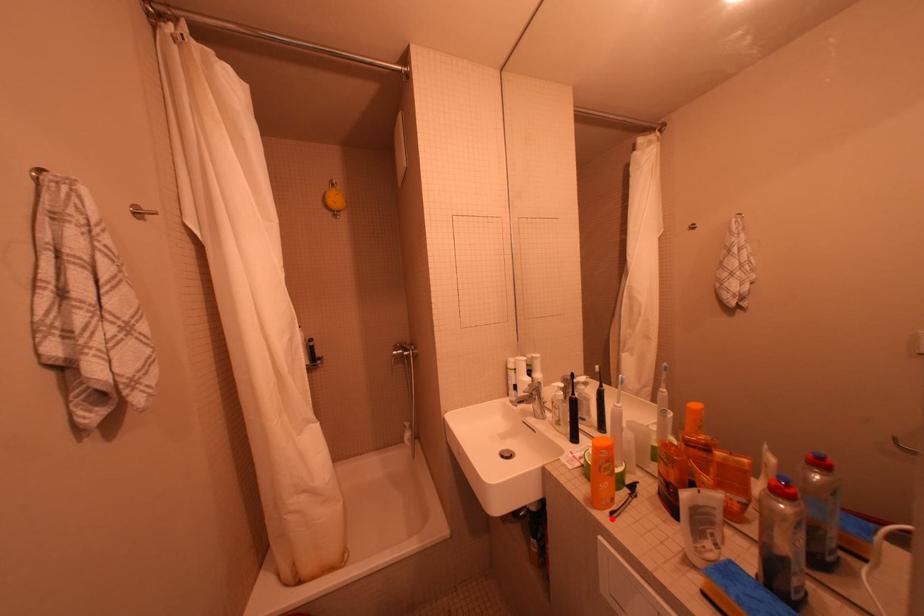
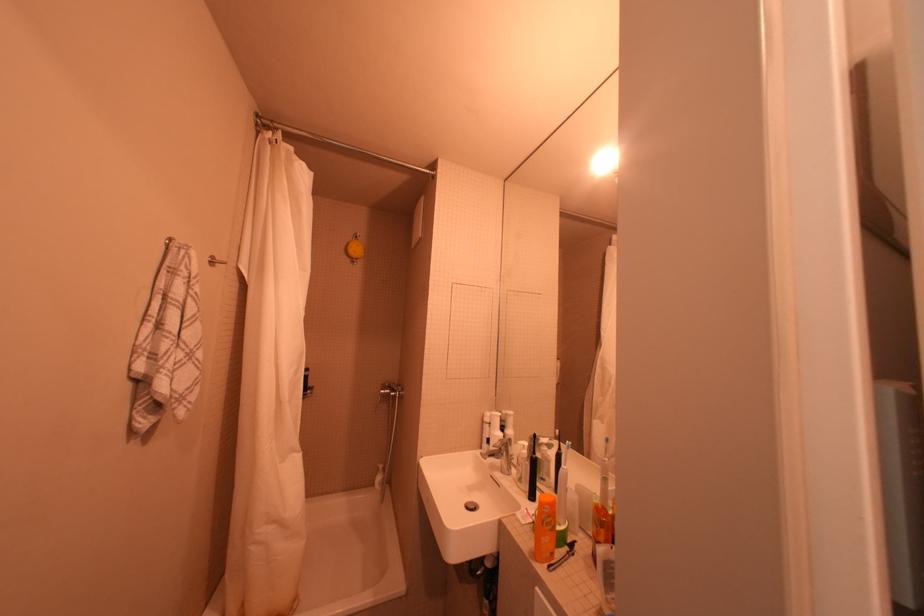
In the second image, find the point that corresponds to the highlighted location in the first image.

(551, 570)